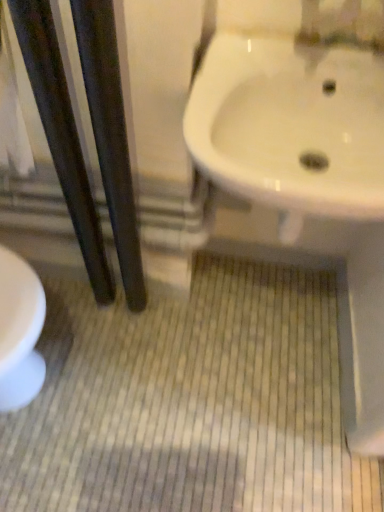
You are a GUI agent. You are given a task and a screenshot of the screen. Output one action in this format:
    pyautogui.click(x=<x>, y=<y>)
    Task: Click on the free point to the right of dark wood pole at left, marked as the first pole in a left-to-right arrangement
    
    Given the screenshot: What is the action you would take?
    pyautogui.click(x=164, y=327)